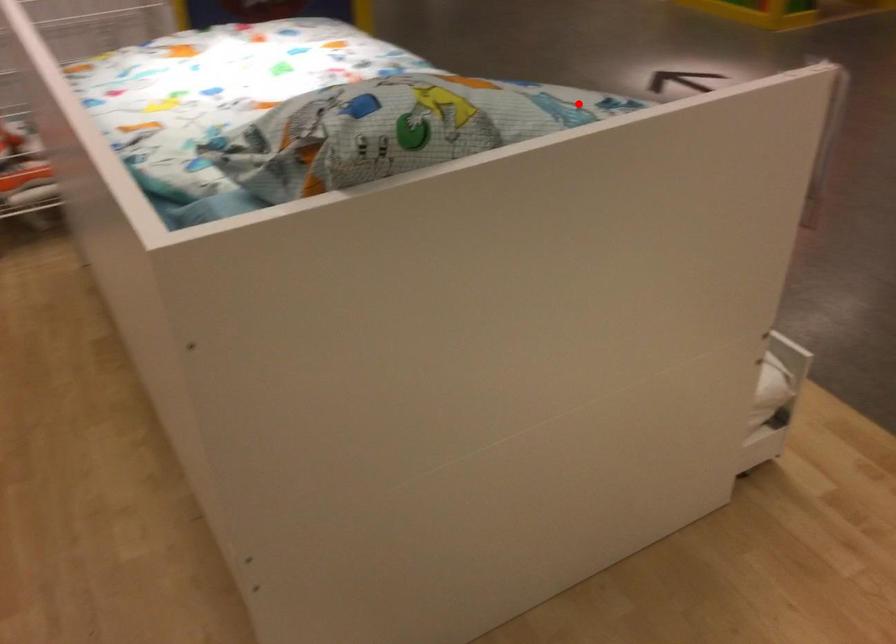
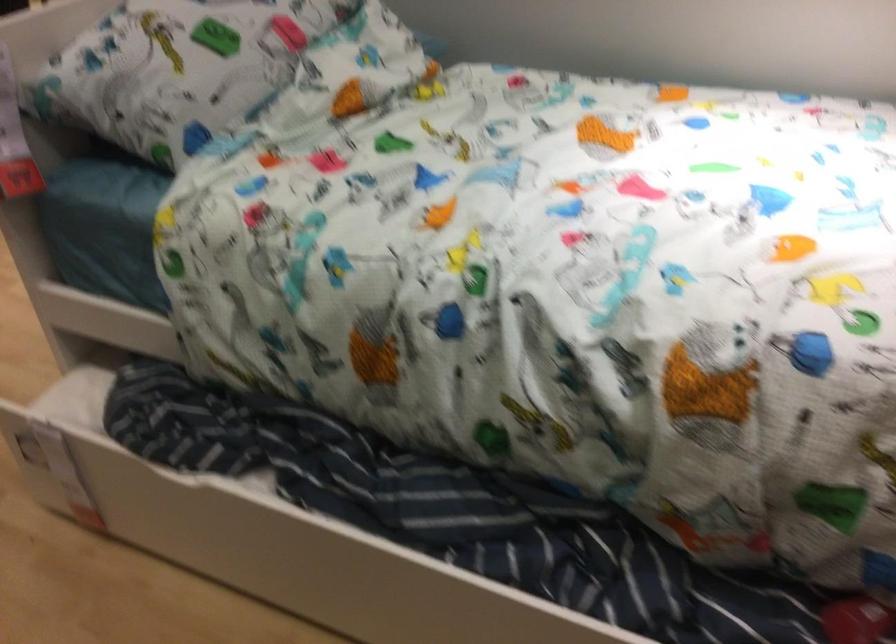
Question: I am providing you with two images of the same scene from different viewpoints. Given a red point in image1, look at the same physical point in image2. Is it:

Choices:
 (A) Closer to the viewpoint
 (B) Farther from the viewpoint

Answer: (B)